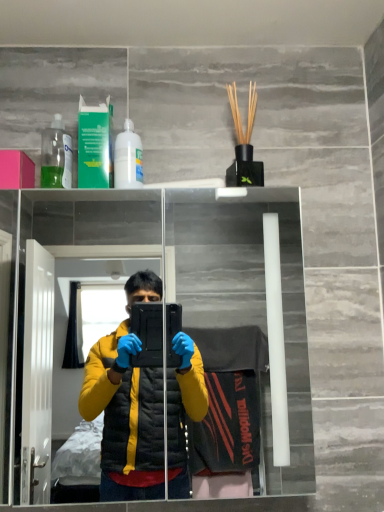
Question: Would you say transparent glass mirror at upper center is inside or outside transparent plastic bottle at upper left, the second bottle viewed from the right?

Choices:
 (A) inside
 (B) outside

Answer: (B)

Question: Considering the positions of transparent glass mirror at upper center and transparent plastic bottle at upper left, placed as the first bottle when sorted from left to right, in the image, is transparent glass mirror at upper center taller or shorter than transparent plastic bottle at upper left, placed as the first bottle when sorted from left to right,?

Choices:
 (A) tall
 (B) short

Answer: (A)

Question: Estimate the real-world distances between objects in this image. Which object is closer to the transparent plastic bottle at upper left, placed as the first bottle when sorted from left to right?

Choices:
 (A) pink matte box at upper left
 (B) white glossy bottle at upper center, the second bottle positioned from the left
 (C) transparent glass mirror at upper center
 (D) green plastic mouthwash at upper left

Answer: (A)

Question: Estimate the real-world distances between objects in this image. Which object is closer to the pink matte box at upper left?

Choices:
 (A) transparent glass mirror at upper center
 (B) transparent plastic bottle at upper left, placed as the first bottle when sorted from left to right
 (C) green plastic mouthwash at upper left
 (D) white glossy bottle at upper center, the first bottle viewed from the right

Answer: (B)